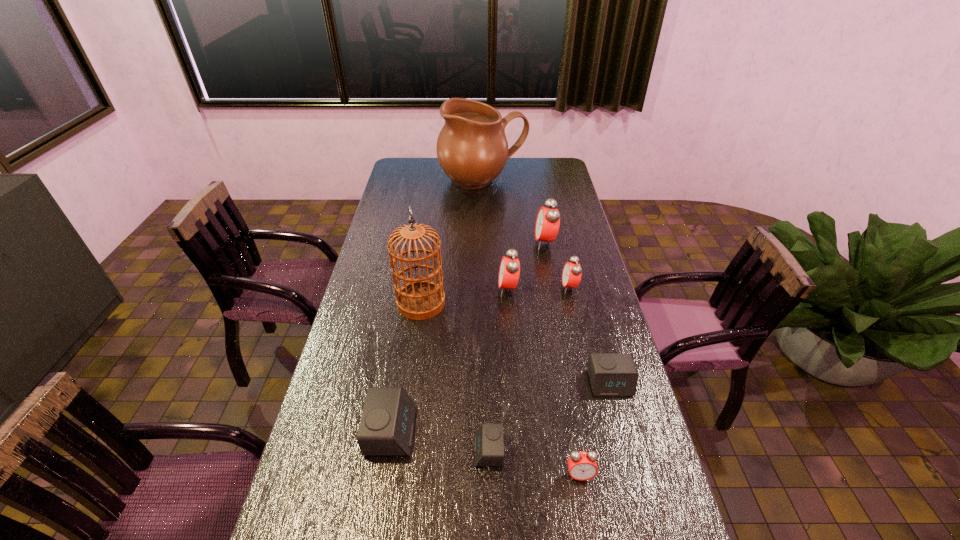
Image resolution: width=960 pixels, height=540 pixels. What are the coordinates of `vacant region between the third tallest alarm clock and the brown cream pitcher` in the screenshot? It's located at (526, 234).

Find the location of `free area in between the brown cream pitcher and the farthest alarm clock`. free area in between the brown cream pitcher and the farthest alarm clock is located at coordinates pyautogui.click(x=514, y=212).

Where is `blank region between the birdcage and the smallest red alarm clock`? This screenshot has height=540, width=960. blank region between the birdcage and the smallest red alarm clock is located at coordinates (500, 389).

The height and width of the screenshot is (540, 960). What are the coordinates of `vacant space in between the biggest black alarm clock and the birdcage` in the screenshot? It's located at (406, 367).

Image resolution: width=960 pixels, height=540 pixels. Find the location of `empty space that is in between the birdcage and the farthest object`. empty space that is in between the birdcage and the farthest object is located at coordinates (452, 242).

Where is `vacant area between the leftmost alarm clock and the birdcage`? vacant area between the leftmost alarm clock and the birdcage is located at coordinates (406, 367).

Locate an element on the screen. object that stands as the fifth closest to the farthest black alarm clock is located at coordinates (420, 299).

Where is `object that is the seventh closest to the nearest red alarm clock`? object that is the seventh closest to the nearest red alarm clock is located at coordinates [547, 224].

The width and height of the screenshot is (960, 540). I want to click on alarm clock identified as the fourth closest to the second biggest black alarm clock, so click(x=509, y=271).

Locate an element on the screen. the seventh closest alarm clock to the birdcage is located at coordinates (582, 466).